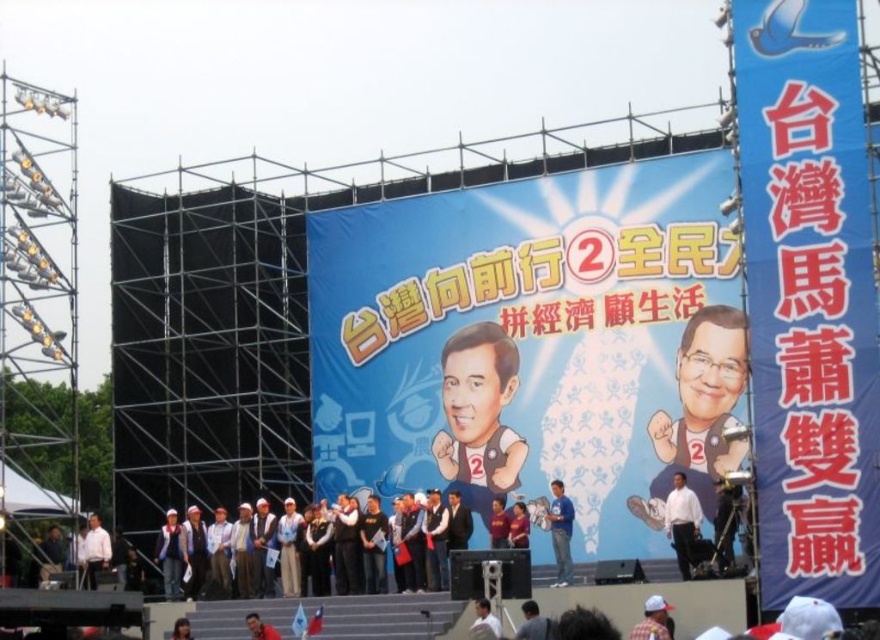
Is point (165, 520) in front of point (250, 625)?

No.

Based on the photo, is white fabric jacket at lower left behind red fabric person at lower left?

Yes, white fabric jacket at lower left is further from the viewer.

The height and width of the screenshot is (640, 880). What do you see at coordinates (171, 556) in the screenshot? I see `white fabric jacket at lower left` at bounding box center [171, 556].

This screenshot has width=880, height=640. In order to click on white fabric jacket at lower left in this screenshot , I will do `click(171, 556)`.

Is white fabric shirt at lower center to the right of red fabric person at lower left from the viewer's perspective?

Correct, you'll find white fabric shirt at lower center to the right of red fabric person at lower left.

Is white fabric shirt at lower center bigger than red fabric person at lower left?

No.

Does point (499, 624) come closer to viewer compared to point (262, 637)?

Yes, it is in front of point (262, 637).

Locate an element on the screen. This screenshot has width=880, height=640. white fabric shirt at lower center is located at coordinates click(x=485, y=621).

Is white glossy shirt at center taller than red fabric person at lower left?

Indeed, white glossy shirt at center has a greater height compared to red fabric person at lower left.

Who is more forward, [732,349] or [262,627]?

Point [732,349] is in front.

This screenshot has height=640, width=880. Identify the location of white glossy shirt at center. (700, 436).

Where is `white glossy shirt at center`? Image resolution: width=880 pixels, height=640 pixels. white glossy shirt at center is located at coordinates (700, 436).